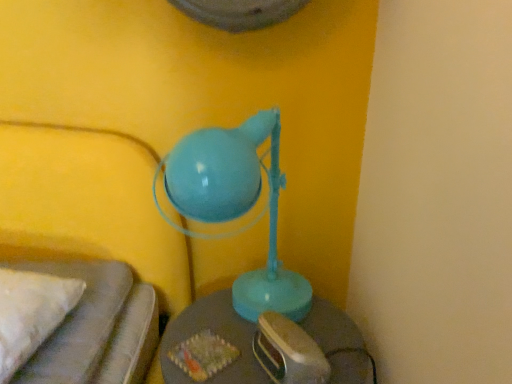
Question: From the image's perspective, is matte gray table at center above or below matte blue lamp at center?

Choices:
 (A) below
 (B) above

Answer: (A)

Question: Would you say matte gray table at center is to the left or to the right of matte blue lamp at center in the picture?

Choices:
 (A) right
 (B) left

Answer: (A)

Question: Based on their sizes in the image, would you say matte gray table at center is bigger or smaller than matte blue lamp at center?

Choices:
 (A) big
 (B) small

Answer: (B)

Question: Based on their sizes in the image, would you say matte blue lamp at center is bigger or smaller than matte gray table at center?

Choices:
 (A) small
 (B) big

Answer: (B)

Question: Visually, is matte blue lamp at center positioned to the left or to the right of matte gray table at center?

Choices:
 (A) left
 (B) right

Answer: (A)

Question: Does point (230, 182) appear closer or farther from the camera than point (165, 377)?

Choices:
 (A) closer
 (B) farther

Answer: (A)

Question: From a real-world perspective, is matte blue lamp at center above or below matte gray table at center?

Choices:
 (A) above
 (B) below

Answer: (A)